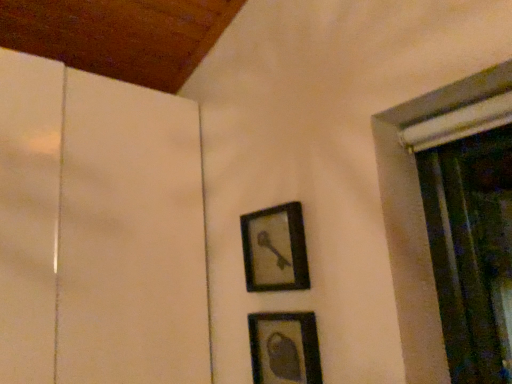
Question: Considering the positions of matte black picture frame at lower center, the second picture frame positioned from the top, and matte black picture frame at center, placed as the second picture frame when sorted from bottom to top, in the image, is matte black picture frame at lower center, the second picture frame positioned from the top, taller or shorter than matte black picture frame at center, placed as the second picture frame when sorted from bottom to top,?

Choices:
 (A) short
 (B) tall

Answer: (A)

Question: From the image's perspective, is matte black picture frame at lower center, the second picture frame positioned from the top, located above or below matte black picture frame at center, placed as the first picture frame when sorted from top to bottom?

Choices:
 (A) above
 (B) below

Answer: (B)

Question: In terms of size, does matte black picture frame at lower center, the second picture frame positioned from the top, appear bigger or smaller than matte black picture frame at center, placed as the second picture frame when sorted from bottom to top?

Choices:
 (A) big
 (B) small

Answer: (B)

Question: From the image's perspective, is matte black picture frame at center, placed as the second picture frame when sorted from bottom to top, located above or below matte black picture frame at lower center, acting as the first picture frame starting from the bottom?

Choices:
 (A) below
 (B) above

Answer: (B)

Question: Relative to matte black picture frame at lower center, the second picture frame positioned from the top, is matte black picture frame at center, placed as the first picture frame when sorted from top to bottom, in front or behind?

Choices:
 (A) front
 (B) behind

Answer: (B)

Question: Considering the positions of matte black picture frame at center, placed as the second picture frame when sorted from bottom to top, and matte black picture frame at lower center, acting as the first picture frame starting from the bottom, in the image, is matte black picture frame at center, placed as the second picture frame when sorted from bottom to top, wider or thinner than matte black picture frame at lower center, acting as the first picture frame starting from the bottom,?

Choices:
 (A) thin
 (B) wide

Answer: (B)

Question: Is matte black picture frame at center, placed as the second picture frame when sorted from bottom to top, taller or shorter than matte black picture frame at lower center, acting as the first picture frame starting from the bottom?

Choices:
 (A) short
 (B) tall

Answer: (B)